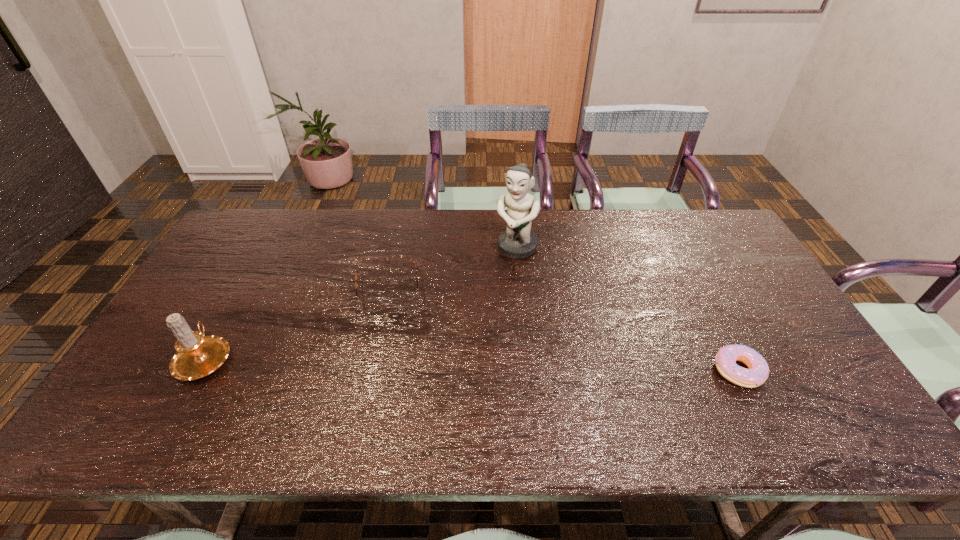
The height and width of the screenshot is (540, 960). I want to click on object at the right edge, so click(x=725, y=360).

In order to click on object that is positioned at the near left corner in this screenshot , I will do `click(197, 356)`.

This screenshot has width=960, height=540. Find the location of `object present at the near right corner`. object present at the near right corner is located at coordinates (725, 360).

Locate an element on the screen. The image size is (960, 540). vacant area at the far edge of the desktop is located at coordinates (383, 232).

At what (x,y) coordinates should I click in order to perform the action: click on vacant region at the near edge of the desktop. Please return your answer as a coordinate pair (x, y). Image resolution: width=960 pixels, height=540 pixels. Looking at the image, I should click on (624, 376).

Locate an element on the screen. free region at the left edge of the desktop is located at coordinates (163, 371).

This screenshot has height=540, width=960. I want to click on free region at the far left corner of the desktop, so click(276, 224).

Where is `vacant space at the near right corner of the desktop`? This screenshot has height=540, width=960. vacant space at the near right corner of the desktop is located at coordinates (788, 373).

Where is `vacant space that's between the second object from left to right and the figurine`? vacant space that's between the second object from left to right and the figurine is located at coordinates (x=453, y=269).

Image resolution: width=960 pixels, height=540 pixels. I want to click on free space between the doughnut and the figurine, so click(x=627, y=309).